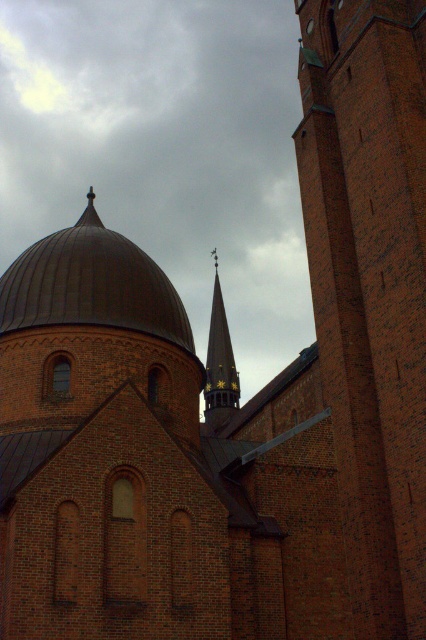
You are standing in front of the historic brick church and want to take a photo of both the brick tower at right and the goldmetallicspire at upper center. Which object should you focus on first to ensure both are in clear view?

You should focus on the brick tower at right first because it is closer to you than the goldmetallicspire at upper center, ensuring both will be in focus when properly adjusted.